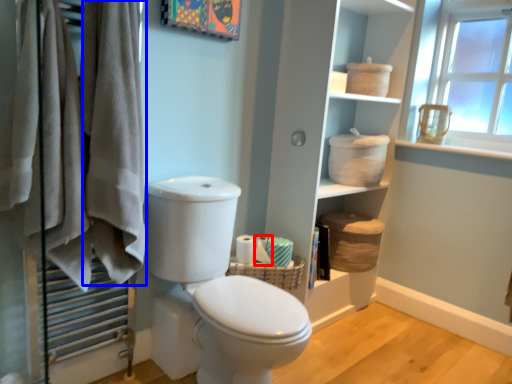
Question: Which object is further to the camera taking this photo, toilet paper (highlighted by a red box) or bath towel (highlighted by a blue box)?

Choices:
 (A) toilet paper
 (B) bath towel

Answer: (A)